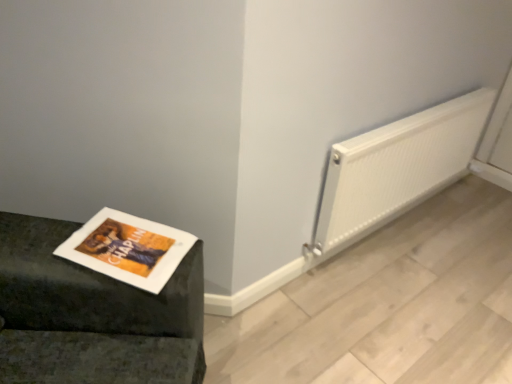
Question: Is white ribbed radiator at right to the left or to the right of matte paper magazine at lower left in the image?

Choices:
 (A) left
 (B) right

Answer: (B)

Question: Is white ribbed radiator at right in front of or behind matte paper magazine at lower left in the image?

Choices:
 (A) front
 (B) behind

Answer: (B)

Question: From a real-world perspective, is white ribbed radiator at right above or below matte paper magazine at lower left?

Choices:
 (A) above
 (B) below

Answer: (B)

Question: From the image's perspective, is matte paper magazine at lower left located above or below white ribbed radiator at right?

Choices:
 (A) below
 (B) above

Answer: (A)

Question: From a real-world perspective, is matte paper magazine at lower left physically located above or below white ribbed radiator at right?

Choices:
 (A) below
 (B) above

Answer: (B)

Question: Looking at their shapes, would you say matte paper magazine at lower left is wider or thinner than white ribbed radiator at right?

Choices:
 (A) wide
 (B) thin

Answer: (A)

Question: Is point (177, 261) closer or farther from the camera than point (431, 147)?

Choices:
 (A) farther
 (B) closer

Answer: (B)